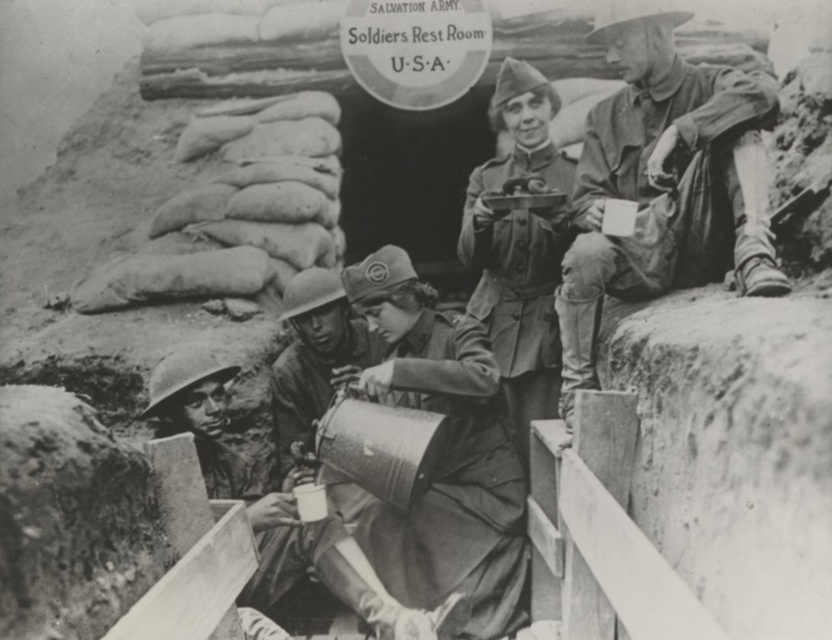
You are a soldier in the trench and need to put on your gear. The matte khaki uniform at center and metallic helmet at center are both yours. Which item should you put on first according to the spatial arrangement?

The matte khaki uniform at center is positioned over the metallic helmet at center, so you should put on the matte khaki uniform at center first, then the metallic helmet at center.